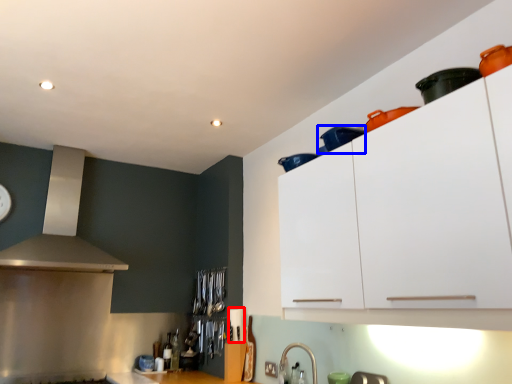
Question: Which object appears closest to the camera in this image, appliance (highlighted by a red box) or appliance (highlighted by a blue box)?

Choices:
 (A) appliance
 (B) appliance

Answer: (B)